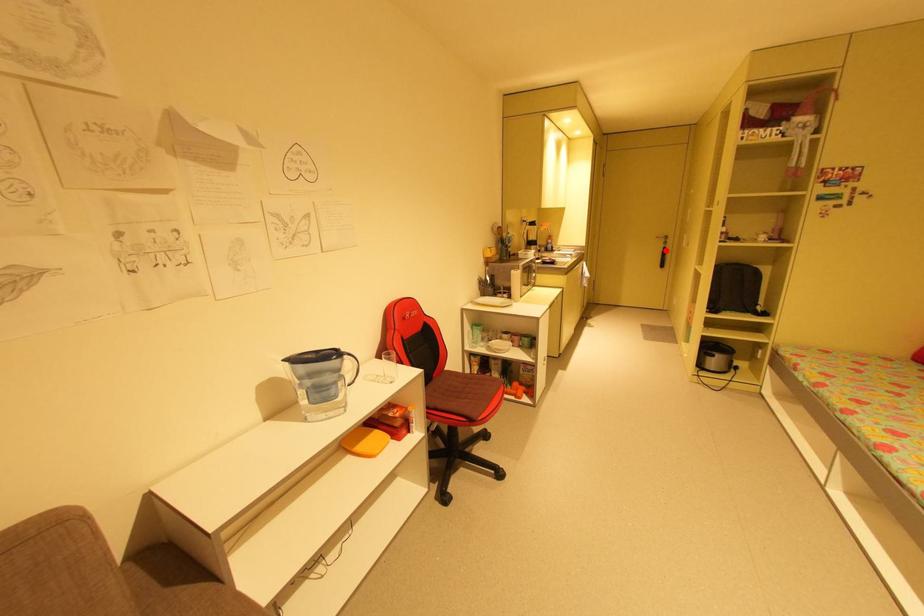
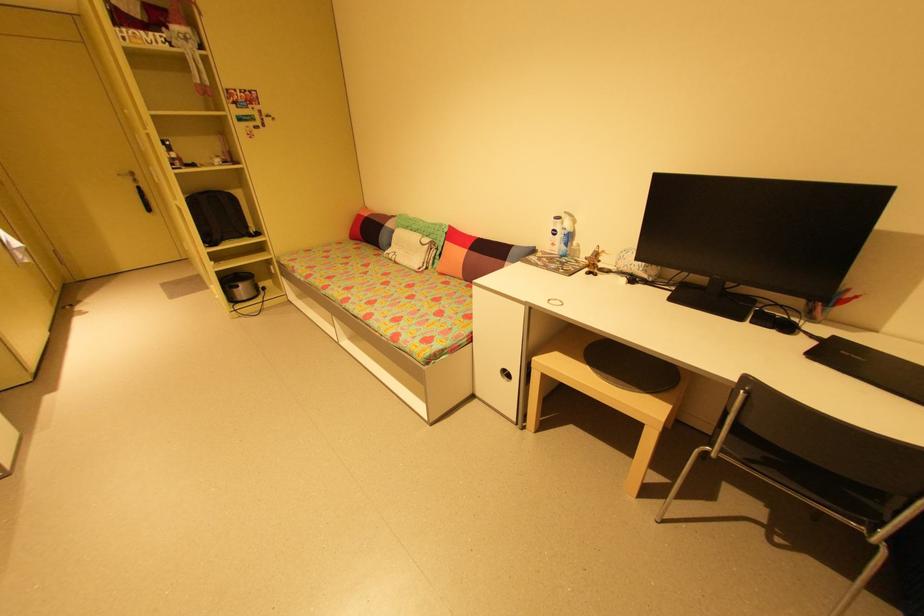
In the second image, find the point that corresponds to the highlighted location in the first image.

(140, 191)